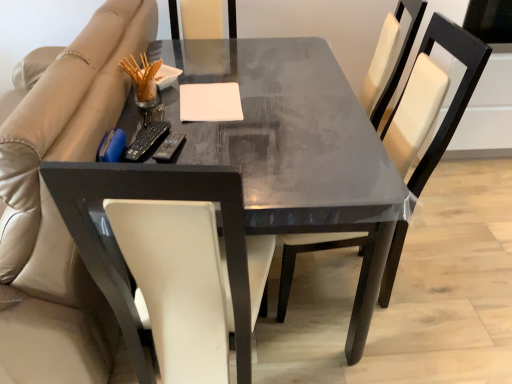
This screenshot has width=512, height=384. I want to click on vacant space to the right of white matte notepad at center, so click(274, 102).